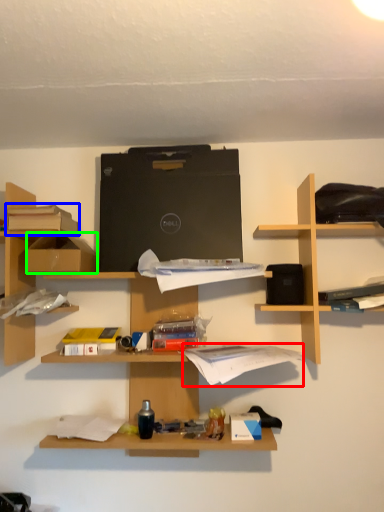
Question: Estimate the real-world distances between objects in this image. Which object is closer to book (highlighted by a red box), book (highlighted by a blue box) or cardboard box (highlighted by a green box)?

Choices:
 (A) book
 (B) cardboard box

Answer: (B)